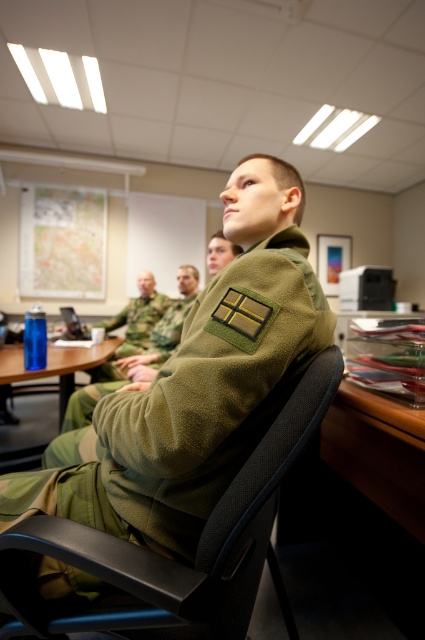
Question: Which of these objects is positioned closest to the camouflage fabric uniform at center?

Choices:
 (A) green fabric uniform at center
 (B) green fleece jacket at center

Answer: (A)

Question: Can you confirm if blue plastic water bottle at left is smaller than camouflage fabric uniform at center?

Choices:
 (A) yes
 (B) no

Answer: (A)

Question: Can you confirm if blue plastic water bottle at left is smaller than green fabric uniform at center?

Choices:
 (A) no
 (B) yes

Answer: (A)

Question: Which is nearer to the camouflage fabric uniform at center?

Choices:
 (A) green fleece jacket at center
 (B) green fabric uniform at center

Answer: (B)

Question: Is blue plastic water bottle at left to the left of camouflage fabric uniform at center from the viewer's perspective?

Choices:
 (A) no
 (B) yes

Answer: (B)

Question: Which point is closer to the camera?

Choices:
 (A) green fabric uniform at center
 (B) green fleece jacket at center

Answer: (B)